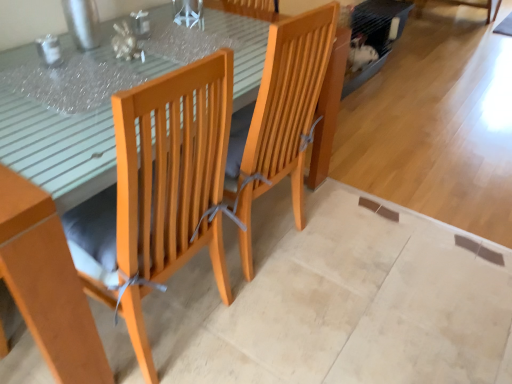
Question: Considering the positions of wooden table at center and wooden chair at center in the image, is wooden table at center wider or thinner than wooden chair at center?

Choices:
 (A) wide
 (B) thin

Answer: (A)

Question: Would you say wooden table at center is to the left or to the right of wooden chair at center in the picture?

Choices:
 (A) left
 (B) right

Answer: (A)

Question: Does point (22, 150) appear closer or farther from the camera than point (256, 178)?

Choices:
 (A) farther
 (B) closer

Answer: (B)

Question: From a real-world perspective, is wooden chair at center physically located above or below wooden table at center?

Choices:
 (A) above
 (B) below

Answer: (A)

Question: In terms of size, does wooden chair at center appear bigger or smaller than wooden table at center?

Choices:
 (A) big
 (B) small

Answer: (B)

Question: Looking at their shapes, would you say wooden chair at center is wider or thinner than wooden table at center?

Choices:
 (A) thin
 (B) wide

Answer: (A)

Question: Is wooden chair at center in front of or behind wooden table at center in the image?

Choices:
 (A) behind
 (B) front

Answer: (A)